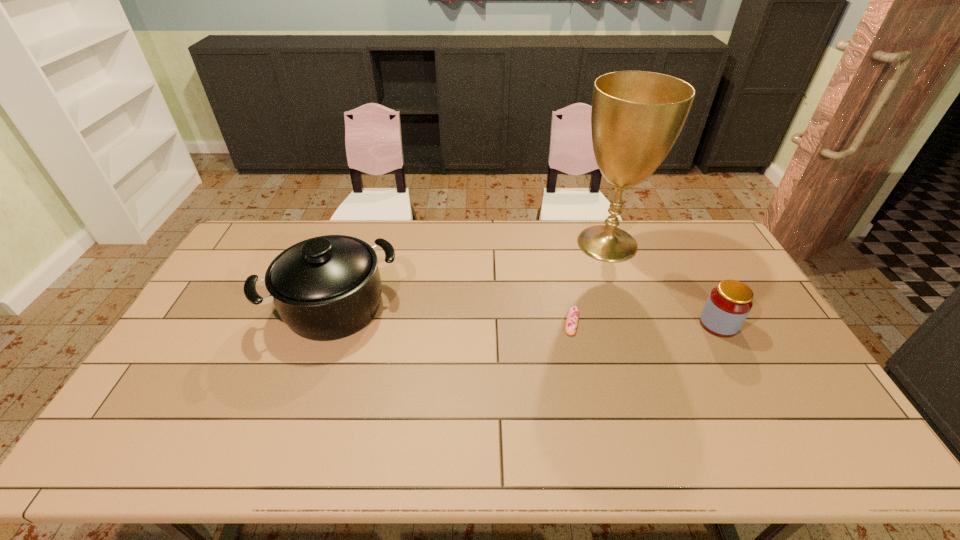
You are a GUI agent. You are given a task and a screenshot of the screen. Output one action in this format:
    pyautogui.click(x=<x>, y=<y>)
    Task: Click on the free region located on the left of the rightmost object
    This screenshot has width=960, height=540.
    Given the screenshot: What is the action you would take?
    pyautogui.click(x=614, y=324)

Where is `free point located on the right of the eclair`? This screenshot has height=540, width=960. free point located on the right of the eclair is located at coordinates (692, 322).

Image resolution: width=960 pixels, height=540 pixels. I want to click on object situated at the far edge, so click(x=636, y=117).

I want to click on object located in the right edge section of the desktop, so [729, 303].

In the image, there is a desktop. Where is `vacant region at the far edge`? Image resolution: width=960 pixels, height=540 pixels. vacant region at the far edge is located at coordinates (573, 231).

Identify the location of vacant space at the near edge of the desktop. (548, 440).

The width and height of the screenshot is (960, 540). Find the location of `vacant space at the left edge of the desktop`. vacant space at the left edge of the desktop is located at coordinates (193, 346).

Locate an element on the screen. vacant position at the right edge of the desktop is located at coordinates (812, 422).

Find the location of a particular element. This screenshot has width=960, height=540. free region at the near right corner of the desktop is located at coordinates (807, 463).

You are a GUI agent. You are given a task and a screenshot of the screen. Output one action in this format:
    pyautogui.click(x=<x>, y=<y>)
    Task: Click on the vacant space that's between the second object from right to left and the jar
    Image resolution: width=960 pixels, height=540 pixels.
    Given the screenshot: What is the action you would take?
    pyautogui.click(x=662, y=284)